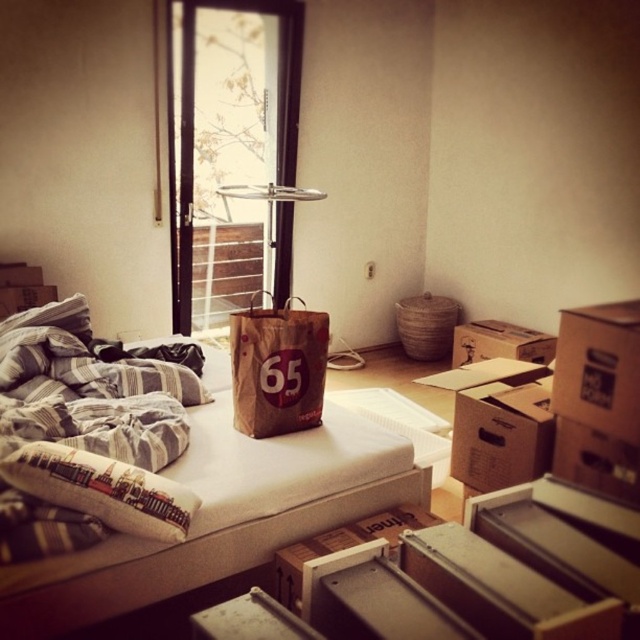
Question: Is brown paper bag at center above printed fabric pillow at center?

Choices:
 (A) yes
 (B) no

Answer: (A)

Question: Among these objects, which one is farthest from the camera?

Choices:
 (A) brown cardboard box at lower center
 (B) brown cardboard box at right
 (C) printed fabric pillow at center
 (D) brown paper bag at center

Answer: (B)

Question: Can you confirm if printed fabric pillow at center is positioned below brown cardboard box at right?

Choices:
 (A) yes
 (B) no

Answer: (A)

Question: Does printed fabric pillow at center appear on the right side of brown cardboard box at lower center?

Choices:
 (A) yes
 (B) no

Answer: (B)

Question: Which is nearer to the brown cardboard box at lower right?

Choices:
 (A) white foam mattress at center
 (B) brown paper bag at center
 (C) brown cardboard box at right
 (D) brown cardboard box at lower center

Answer: (A)

Question: Which of these objects is positioned farthest from the brown cardboard box at right?

Choices:
 (A) brown cardboard box at lower right
 (B) brown paper bag at center
 (C) brown cardboard box at lower center

Answer: (C)